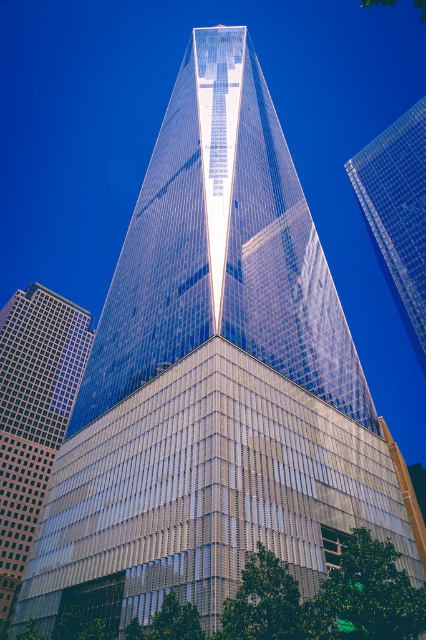
Question: Which point is farther to the camera?

Choices:
 (A) glassy skyscraper at left
 (B) transparent glass skyscraper at upper right

Answer: (B)

Question: Where is glassy skyscraper at left located in relation to transparent glass skyscraper at upper right in the image?

Choices:
 (A) above
 (B) below

Answer: (B)

Question: Can you confirm if glassy skyscraper at left is positioned below transparent glass skyscraper at upper right?

Choices:
 (A) no
 (B) yes

Answer: (B)

Question: Which of the following is the farthest from the observer?

Choices:
 (A) transparent glass skyscraper at upper right
 (B) glassy skyscraper at left

Answer: (A)

Question: Does glassy skyscraper at left lie in front of transparent glass skyscraper at upper right?

Choices:
 (A) yes
 (B) no

Answer: (A)